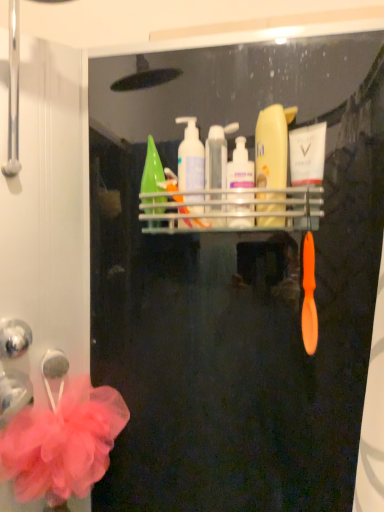
Describe the element at coordinates (307, 154) in the screenshot. I see `white glossy mouthwash at upper center, which is the second mouthwash from left to right` at that location.

This screenshot has width=384, height=512. What do you see at coordinates (190, 157) in the screenshot?
I see `translucent plastic pump bottle at upper center, the 3th cleaning product positioned from the right` at bounding box center [190, 157].

This screenshot has height=512, width=384. In order to click on pink mesh flower at lower left in this screenshot , I will do `click(63, 443)`.

This screenshot has height=512, width=384. Find the location of `translucent plastic mouthwash at center, marked as the 1th mouthwash in a left-to-right arrangement`. translucent plastic mouthwash at center, marked as the 1th mouthwash in a left-to-right arrangement is located at coordinates (217, 156).

From the image's perspective, between matte yellow bottle at center, the first cleaning product positioned from the right, and translucent plastic pump bottle at center, which ranks as the second cleaning product in right-to-left order, which one is located above?

matte yellow bottle at center, the first cleaning product positioned from the right, is shown above in the image.

Is translucent plastic pump bottle at center, marked as the third cleaning product in a left-to-right arrangement, at the back of matte yellow bottle at center, the first cleaning product positioned from the right?

matte yellow bottle at center, the first cleaning product positioned from the right, is not turned away from translucent plastic pump bottle at center, marked as the third cleaning product in a left-to-right arrangement.

Considering the sizes of matte yellow bottle at center, the first cleaning product positioned from the right, and translucent plastic pump bottle at center, which ranks as the second cleaning product in right-to-left order, in the image, is matte yellow bottle at center, the first cleaning product positioned from the right, bigger or smaller than translucent plastic pump bottle at center, which ranks as the second cleaning product in right-to-left order,?

In the image, matte yellow bottle at center, the first cleaning product positioned from the right, appears to be larger than translucent plastic pump bottle at center, which ranks as the second cleaning product in right-to-left order.

From a real-world perspective, is matte yellow bottle at center, marked as the 4th cleaning product in a left-to-right arrangement, physically located above or below translucent plastic pump bottle at center, which ranks as the second cleaning product in right-to-left order?

matte yellow bottle at center, marked as the 4th cleaning product in a left-to-right arrangement, is situated higher than translucent plastic pump bottle at center, which ranks as the second cleaning product in right-to-left order, in the real world.

From the picture: From a real-world perspective, is pink mesh flower at lower left physically above matte yellow bottle at center, the first cleaning product positioned from the right?

Incorrect, from a real-world perspective, pink mesh flower at lower left is lower than matte yellow bottle at center, the first cleaning product positioned from the right.

Does pink mesh flower at lower left have a greater width compared to matte yellow bottle at center, the first cleaning product positioned from the right?

Yes, pink mesh flower at lower left is wider than matte yellow bottle at center, the first cleaning product positioned from the right.

Locate an element on the screen. the 1st cleaning product behind the pink mesh flower at lower left, counting from the anchor's position is located at coordinates (272, 146).

Are pink mesh flower at lower left and matte yellow bottle at center, the first cleaning product positioned from the right, far apart?

pink mesh flower at lower left is near matte yellow bottle at center, the first cleaning product positioned from the right, not far away.

Is pink mesh flower at lower left shorter than translucent plastic pump bottle at center, marked as the third cleaning product in a left-to-right arrangement?

No, pink mesh flower at lower left is not shorter than translucent plastic pump bottle at center, marked as the third cleaning product in a left-to-right arrangement.

Is pink mesh flower at lower left positioned with its back to translucent plastic pump bottle at center, marked as the third cleaning product in a left-to-right arrangement?

No, pink mesh flower at lower left's orientation is not away from translucent plastic pump bottle at center, marked as the third cleaning product in a left-to-right arrangement.

In terms of width, does pink mesh flower at lower left look wider or thinner when compared to translucent plastic pump bottle at center, which ranks as the second cleaning product in right-to-left order?

In the image, pink mesh flower at lower left appears to be wider than translucent plastic pump bottle at center, which ranks as the second cleaning product in right-to-left order.

From the image's perspective, which one is positioned lower, pink mesh flower at lower left or translucent plastic pump bottle at center, marked as the third cleaning product in a left-to-right arrangement?

pink mesh flower at lower left is shown below in the image.

Based on their sizes in the image, would you say translucent plastic pump bottle at center, which ranks as the second cleaning product in right-to-left order, is bigger or smaller than white glossy mouthwash at upper center, the first mouthwash from the right?

In the image, translucent plastic pump bottle at center, which ranks as the second cleaning product in right-to-left order, appears to be larger than white glossy mouthwash at upper center, the first mouthwash from the right.

Considering the sizes of objects translucent plastic pump bottle at center, which ranks as the second cleaning product in right-to-left order, and white glossy mouthwash at upper center, which is the second mouthwash from left to right, in the image provided, who is wider, translucent plastic pump bottle at center, which ranks as the second cleaning product in right-to-left order, or white glossy mouthwash at upper center, which is the second mouthwash from left to right,?

translucent plastic pump bottle at center, which ranks as the second cleaning product in right-to-left order.

Which object is more forward, translucent plastic pump bottle at center, marked as the third cleaning product in a left-to-right arrangement, or white glossy mouthwash at upper center, which is the second mouthwash from left to right?

translucent plastic pump bottle at center, marked as the third cleaning product in a left-to-right arrangement.

Is translucent plastic pump bottle at center, which ranks as the second cleaning product in right-to-left order, situated inside translucent plastic mouthwash at center, marked as the 1th mouthwash in a left-to-right arrangement, or outside?

translucent plastic pump bottle at center, which ranks as the second cleaning product in right-to-left order, cannot be found inside translucent plastic mouthwash at center, marked as the 1th mouthwash in a left-to-right arrangement.

Measure the distance between translucent plastic pump bottle at center, which ranks as the second cleaning product in right-to-left order, and translucent plastic mouthwash at center, the second mouthwash from the right.

translucent plastic pump bottle at center, which ranks as the second cleaning product in right-to-left order, is 1.06 inches from translucent plastic mouthwash at center, the second mouthwash from the right.

Considering the relative sizes of translucent plastic pump bottle at center, marked as the third cleaning product in a left-to-right arrangement, and translucent plastic mouthwash at center, the second mouthwash from the right, in the image provided, is translucent plastic pump bottle at center, marked as the third cleaning product in a left-to-right arrangement, wider than translucent plastic mouthwash at center, the second mouthwash from the right,?

Yes.

From a real-world perspective, is translucent plastic pump bottle at center, marked as the third cleaning product in a left-to-right arrangement, positioned over translucent plastic mouthwash at center, marked as the 1th mouthwash in a left-to-right arrangement, based on gravity?

No, from a real-world perspective, translucent plastic pump bottle at center, marked as the third cleaning product in a left-to-right arrangement, is not on top of translucent plastic mouthwash at center, marked as the 1th mouthwash in a left-to-right arrangement.

Is pink mesh flower at lower left at the left side of green matte bottle at center, positioned as the fourth cleaning product in right-to-left order?

Yes, pink mesh flower at lower left is to the left of green matte bottle at center, positioned as the fourth cleaning product in right-to-left order.

Which is closer, [92,480] or [147,222]?

Clearly, point [92,480] is more distant from the camera than point [147,222].

Can you tell me how much pink mesh flower at lower left and green matte bottle at center, positioned as the fourth cleaning product in right-to-left order, differ in facing direction?

45.1 degrees.

From the image's perspective, which object appears higher, pink mesh flower at lower left or green matte bottle at center, positioned as the fourth cleaning product in right-to-left order?

green matte bottle at center, positioned as the fourth cleaning product in right-to-left order, appears higher in the image.

In terms of height, does white glossy mouthwash at upper center, which is the second mouthwash from left to right, look taller or shorter compared to translucent plastic pump bottle at center, marked as the third cleaning product in a left-to-right arrangement?

white glossy mouthwash at upper center, which is the second mouthwash from left to right, is taller than translucent plastic pump bottle at center, marked as the third cleaning product in a left-to-right arrangement.

Measure the distance between white glossy mouthwash at upper center, the first mouthwash from the right, and translucent plastic pump bottle at center, which ranks as the second cleaning product in right-to-left order.

A distance of 10.15 centimeters exists between white glossy mouthwash at upper center, the first mouthwash from the right, and translucent plastic pump bottle at center, which ranks as the second cleaning product in right-to-left order.

Is the position of white glossy mouthwash at upper center, the first mouthwash from the right, more distant than that of translucent plastic pump bottle at center, marked as the third cleaning product in a left-to-right arrangement?

Yes, white glossy mouthwash at upper center, the first mouthwash from the right, is further from the camera.

Starting from the white glossy mouthwash at upper center, which is the second mouthwash from left to right, which cleaning product is the 1st one in front? Please provide its 2D coordinates.

[(240, 167)]

Locate an element on the screen. This screenshot has width=384, height=512. cleaning product that is on the right side of translucent plastic pump bottle at center, which ranks as the second cleaning product in right-to-left order is located at coordinates (272, 146).

From the pink mesh flower at lower left, count 1st cleaning products backward and point to it. Please provide its 2D coordinates.

[(272, 146)]

When comparing their distances from white glossy mouthwash at upper center, the first mouthwash from the right, does matte yellow bottle at center, marked as the 4th cleaning product in a left-to-right arrangement, or translucent plastic mouthwash at center, marked as the 1th mouthwash in a left-to-right arrangement, seem closer?

The object closer to white glossy mouthwash at upper center, the first mouthwash from the right, is matte yellow bottle at center, marked as the 4th cleaning product in a left-to-right arrangement.

Considering their positions, is white glossy mouthwash at upper center, the first mouthwash from the right, positioned closer to translucent plastic pump bottle at upper center, the 3th cleaning product positioned from the right, than pink mesh flower at lower left?

Among the two, white glossy mouthwash at upper center, the first mouthwash from the right, is located nearer to translucent plastic pump bottle at upper center, the 3th cleaning product positioned from the right.

When comparing their distances from pink mesh flower at lower left, does translucent plastic mouthwash at center, marked as the 1th mouthwash in a left-to-right arrangement, or green matte bottle at center, which ranks as the 1th cleaning product in left-to-right order, seem closer?

Based on the image, green matte bottle at center, which ranks as the 1th cleaning product in left-to-right order, appears to be nearer to pink mesh flower at lower left.

From the image, which object appears to be farther from pink mesh flower at lower left, translucent plastic pump bottle at upper center, the 3th cleaning product positioned from the right, or translucent plastic pump bottle at center, which ranks as the second cleaning product in right-to-left order?

translucent plastic pump bottle at center, which ranks as the second cleaning product in right-to-left order, is positioned further to the anchor pink mesh flower at lower left.

Based on their spatial positions, is matte yellow bottle at center, marked as the 4th cleaning product in a left-to-right arrangement, or pink mesh flower at lower left further from translucent plastic pump bottle at upper center, the second cleaning product positioned from the left?

pink mesh flower at lower left is further to translucent plastic pump bottle at upper center, the second cleaning product positioned from the left.

Based on their spatial positions, is white glossy mouthwash at upper center, the first mouthwash from the right, or pink mesh flower at lower left closer to matte yellow bottle at center, marked as the 4th cleaning product in a left-to-right arrangement?

white glossy mouthwash at upper center, the first mouthwash from the right, is positioned closer to the anchor matte yellow bottle at center, marked as the 4th cleaning product in a left-to-right arrangement.

Estimate the real-world distances between objects in this image. Which object is further from translucent plastic pump bottle at center, marked as the third cleaning product in a left-to-right arrangement, pink mesh flower at lower left or matte yellow bottle at center, marked as the 4th cleaning product in a left-to-right arrangement?

pink mesh flower at lower left is positioned further to the anchor translucent plastic pump bottle at center, marked as the third cleaning product in a left-to-right arrangement.

From the image, which object appears to be farther from translucent plastic pump bottle at upper center, the second cleaning product positioned from the left, white glossy mouthwash at upper center, the first mouthwash from the right, or translucent plastic pump bottle at center, marked as the third cleaning product in a left-to-right arrangement?

white glossy mouthwash at upper center, the first mouthwash from the right.

Find the location of a particular element. The width and height of the screenshot is (384, 512). mouthwash between green matte bottle at center, positioned as the fourth cleaning product in right-to-left order, and translucent plastic pump bottle at center, marked as the third cleaning product in a left-to-right arrangement is located at coordinates (217, 156).

Identify the location of cleaning product between green matte bottle at center, positioned as the fourth cleaning product in right-to-left order, and translucent plastic mouthwash at center, marked as the 1th mouthwash in a left-to-right arrangement, from left to right. (190, 157).

Find the location of a particular element. This screenshot has height=512, width=384. mouthwash that lies between white glossy mouthwash at upper center, which is the second mouthwash from left to right, and pink mesh flower at lower left from top to bottom is located at coordinates (217, 156).

This screenshot has width=384, height=512. Find the location of `cleaning product situated between translucent plastic pump bottle at center, which ranks as the second cleaning product in right-to-left order, and white glossy mouthwash at upper center, which is the second mouthwash from left to right, from left to right`. cleaning product situated between translucent plastic pump bottle at center, which ranks as the second cleaning product in right-to-left order, and white glossy mouthwash at upper center, which is the second mouthwash from left to right, from left to right is located at coordinates (272, 146).